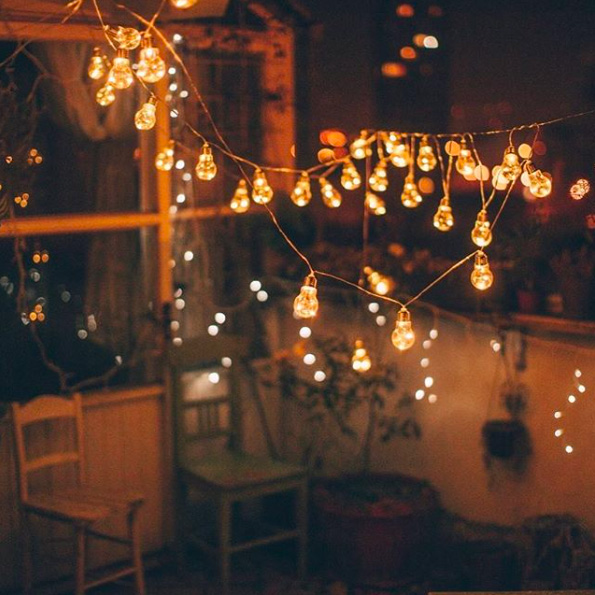
I want to click on brown chair, so click(x=86, y=509).